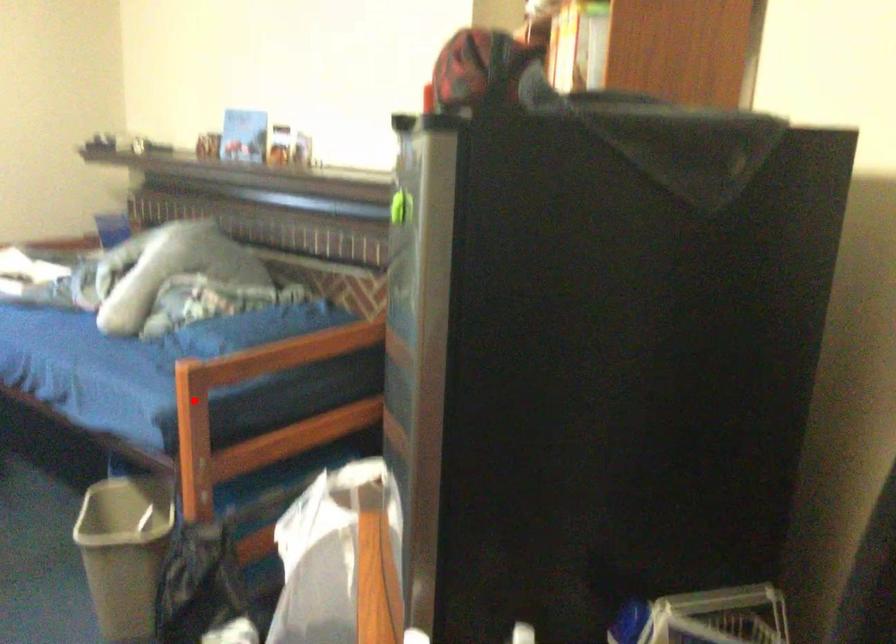
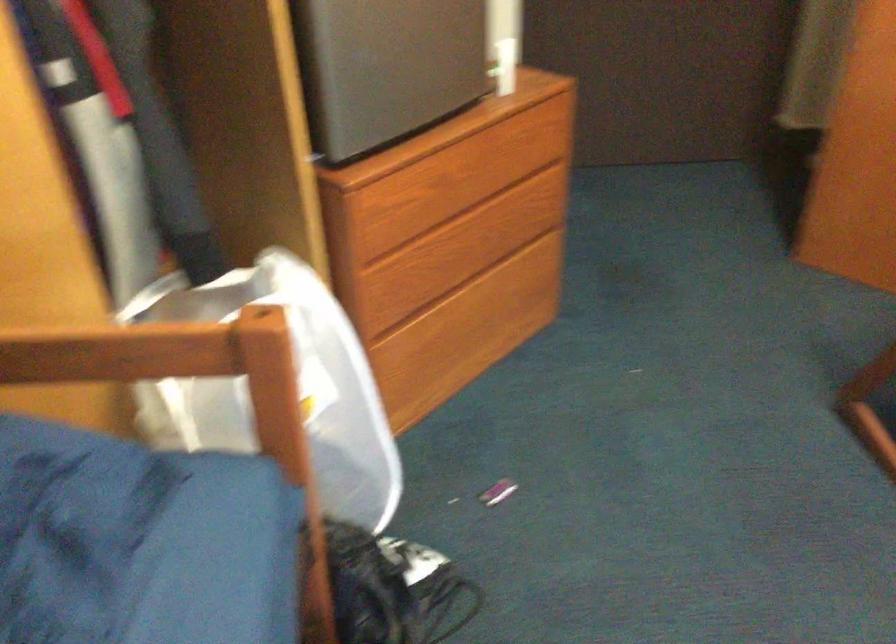
Question: I am providing you with two images of the same scene from different viewpoints. A red point is shown in image1. For the corresponding object point in image2, is it positioned nearer or farther from the camera?

Choices:
 (A) Nearer
 (B) Farther

Answer: (A)